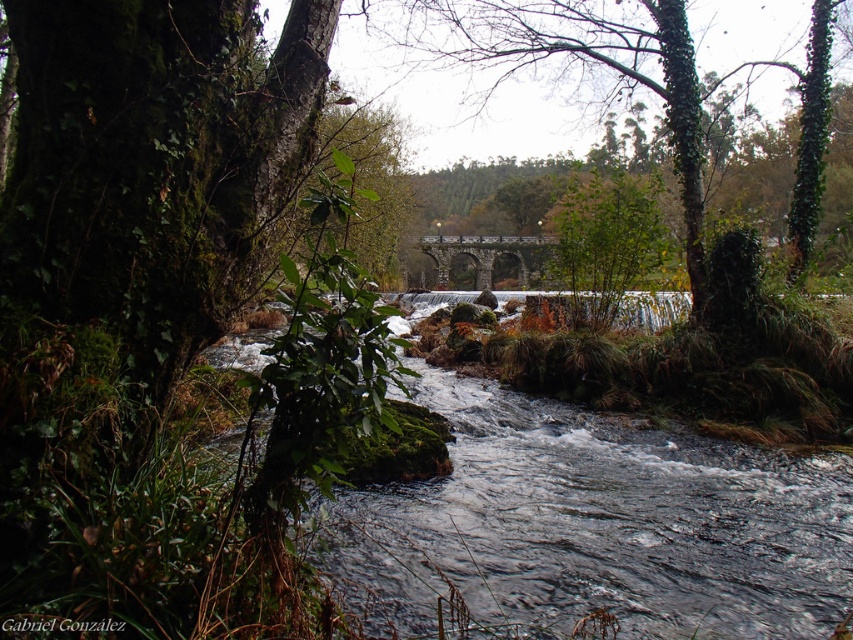
Can you confirm if clear water at center is positioned to the left of green leafy tree at center?

Correct, you'll find clear water at center to the left of green leafy tree at center.

Measure the distance between clear water at center and green leafy tree at center.

clear water at center is 5.54 meters away from green leafy tree at center.

Measure the distance between point (445, 493) and camera.

A distance of 5.25 meters exists between point (445, 493) and camera.

The width and height of the screenshot is (853, 640). I want to click on clear water at center, so click(x=595, y=525).

The width and height of the screenshot is (853, 640). Identify the location of clear water at center. (595, 525).

Identify the location of clear water at center. The height and width of the screenshot is (640, 853). (595, 525).

Is green leafy tree at center to the right of stone arch bridge at center from the viewer's perspective?

No, green leafy tree at center is not to the right of stone arch bridge at center.

Identify the location of green leafy tree at center. The height and width of the screenshot is (640, 853). (576, 65).